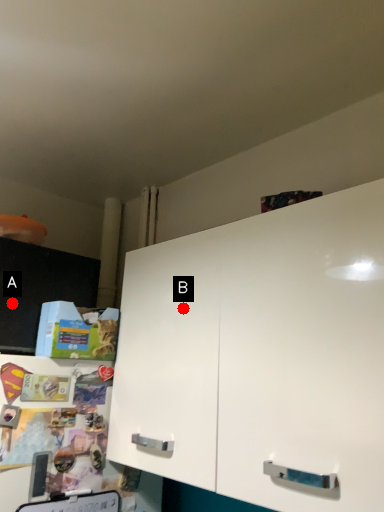
Question: Two points are circled on the image, labeled by A and B beside each circle. Which point is closer to the camera?

Choices:
 (A) A is closer
 (B) B is closer

Answer: (B)